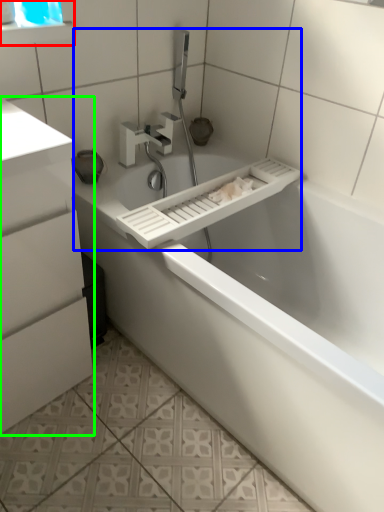
Question: Based on their relative distances, which object is farther from medicine cabinet (highlighted by a red box)? Choose from sink (highlighted by a blue box) and bathroom cabinet (highlighted by a green box).

Choices:
 (A) sink
 (B) bathroom cabinet

Answer: (B)